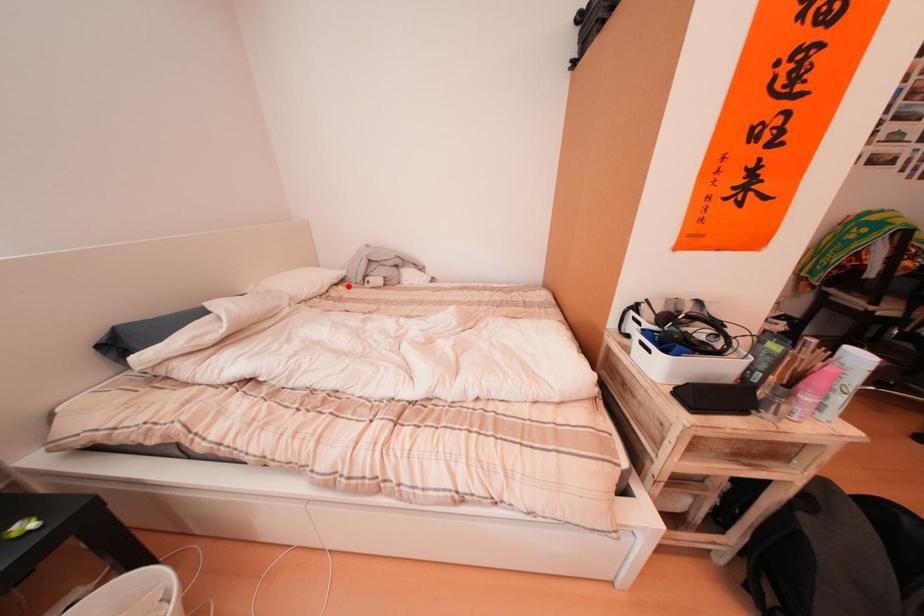
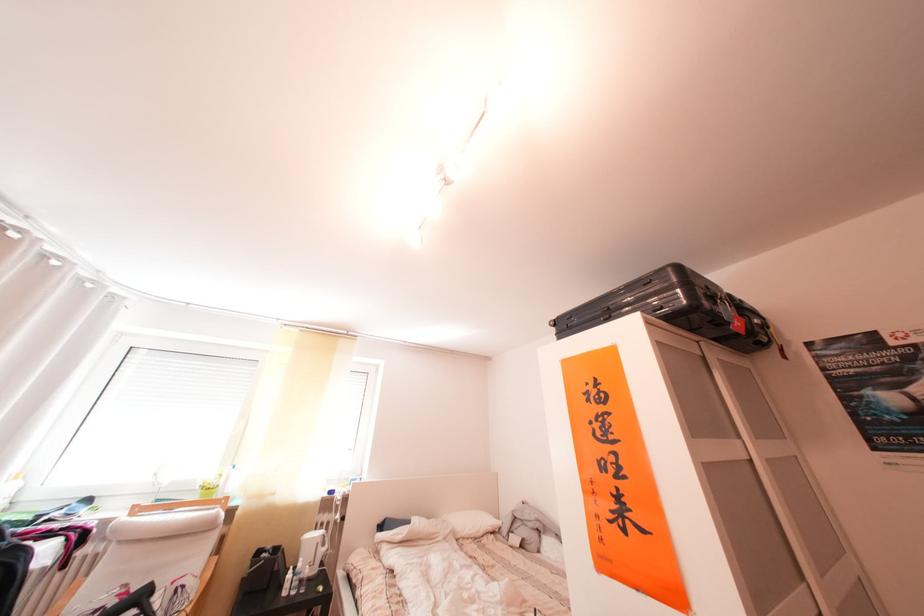
Find the pixel in the second image that matches the highlighted location in the first image.

(504, 535)